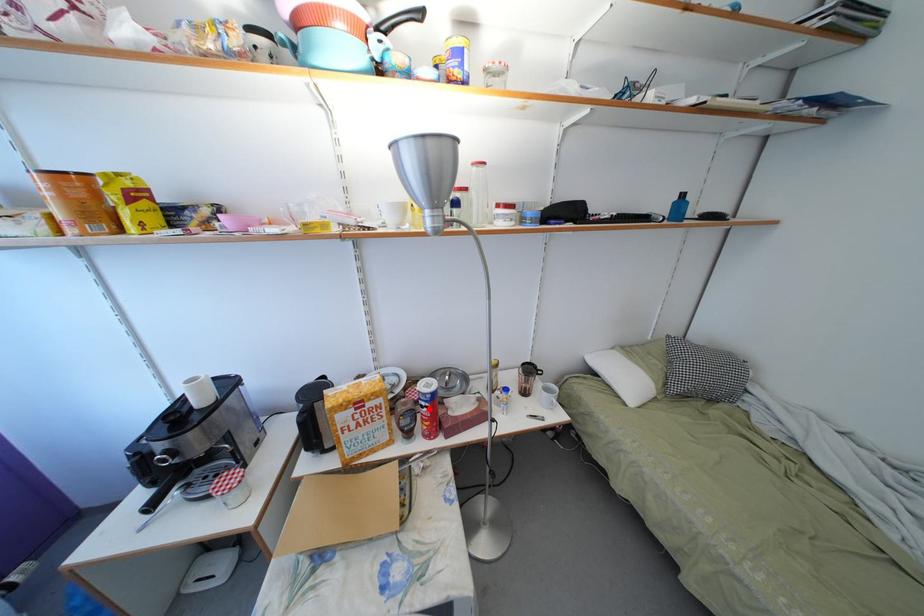
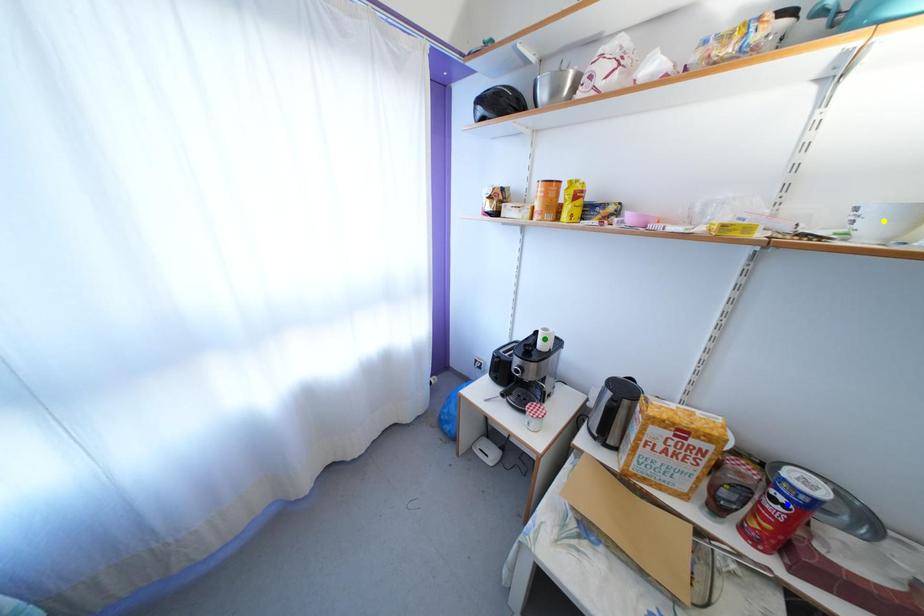
Question: I am providing you with two images of the same scene from different viewpoints. A red point is marked on the first image. You are given multiple points on the second image. Which point in image 2 is actually the same real-world point as the red point in image 1?

Choices:
 (A) yellow point
 (B) green point
 (C) blue point

Answer: (C)